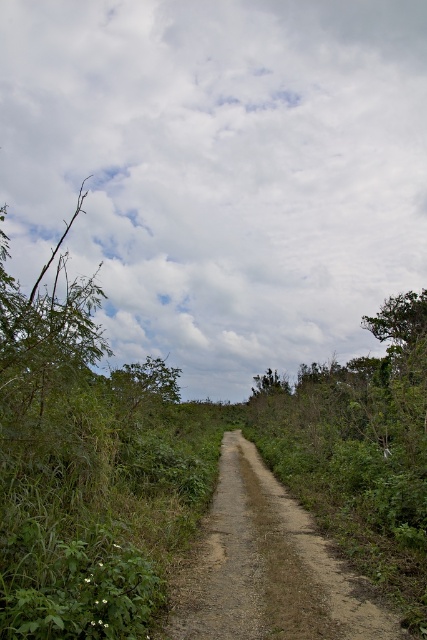
You are a hiker who wants to follow the path to reach a distant viewpoint. Based on the image, where is the brown dirt track at center located in the image?

The brown dirt track at center is located at point (268, 566) in the image.